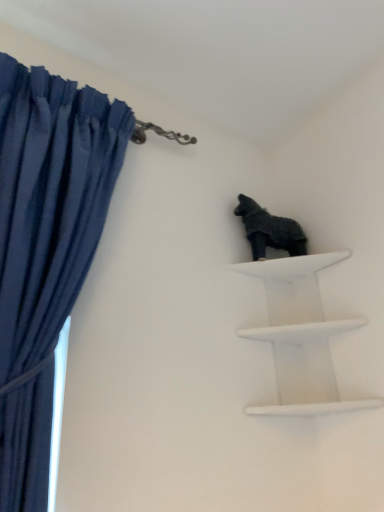
Question: Is shiny black statue at upper right to the left of white matte shelf at upper right from the viewer's perspective?

Choices:
 (A) no
 (B) yes

Answer: (B)

Question: Would you say white matte shelf at upper right is part of shiny black statue at upper right's contents?

Choices:
 (A) no
 (B) yes

Answer: (A)

Question: Does shiny black statue at upper right have a larger size compared to white matte shelf at upper right?

Choices:
 (A) no
 (B) yes

Answer: (A)

Question: Is shiny black statue at upper right not close to white matte shelf at upper right?

Choices:
 (A) no
 (B) yes

Answer: (A)

Question: Is shiny black statue at upper right next to white matte shelf at upper right and touching it?

Choices:
 (A) no
 (B) yes

Answer: (A)

Question: Is shiny black statue at upper right smaller than white matte shelf at upper right?

Choices:
 (A) yes
 (B) no

Answer: (A)

Question: Are white matte shelf at upper right and dark blue fabric at left making contact?

Choices:
 (A) yes
 (B) no

Answer: (B)

Question: From a real-world perspective, is white matte shelf at upper right physically below dark blue fabric at left?

Choices:
 (A) no
 (B) yes

Answer: (B)

Question: From a real-world perspective, is white matte shelf at upper right over dark blue fabric at left?

Choices:
 (A) no
 (B) yes

Answer: (A)

Question: Is white matte shelf at upper right smaller than dark blue fabric at left?

Choices:
 (A) yes
 (B) no

Answer: (A)

Question: Is white matte shelf at upper right to the left of dark blue fabric at left from the viewer's perspective?

Choices:
 (A) yes
 (B) no

Answer: (B)

Question: Is white matte shelf at upper right facing towards dark blue fabric at left?

Choices:
 (A) no
 (B) yes

Answer: (A)

Question: Can you confirm if shiny black statue at upper right is wider than dark blue fabric at left?

Choices:
 (A) no
 (B) yes

Answer: (A)